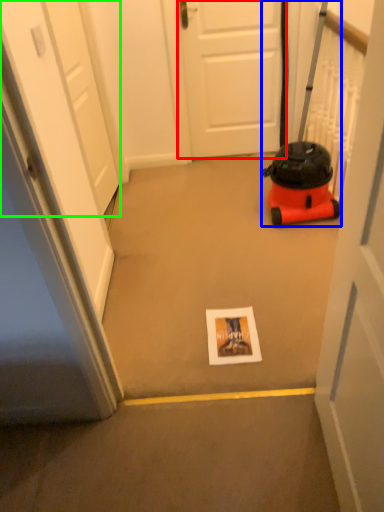
Question: Estimate the real-world distances between objects in this image. Which object is closer to door (highlighted by a red box), equipment (highlighted by a blue box) or door (highlighted by a green box)?

Choices:
 (A) equipment
 (B) door

Answer: (A)